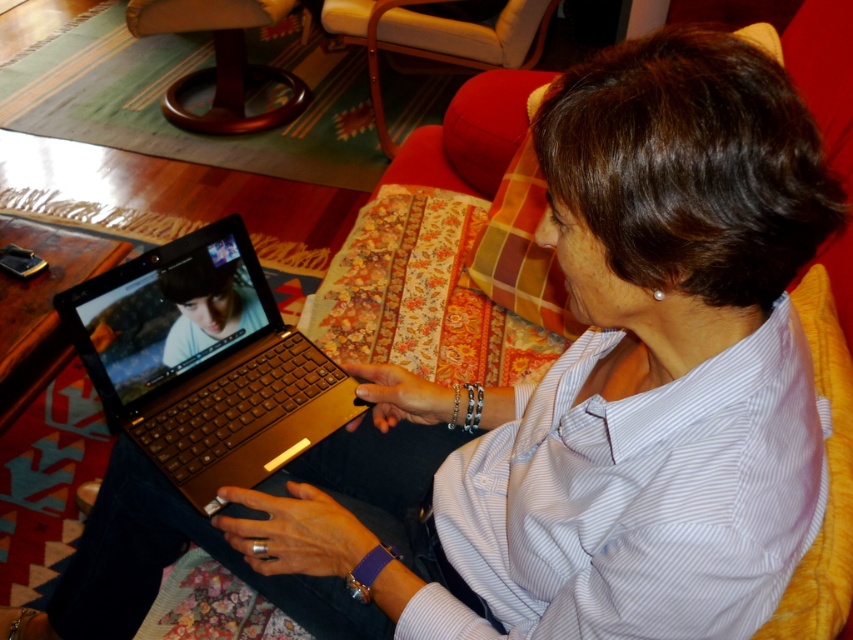
You are a delivery person who needs to place a small package on the gold metallic laptop at center. Can you safely place it there without obstructing the screen?

The gold metallic laptop at center is 92.41 centimeters away from the viewer, so yes, the delivery person can safely place the small package there without obstructing the screen.

You are a furniture designer evaluating seating options for a client who prefers taller chairs. Based on the scene, which chair would you recommend between the red leather armchair at upper center and the mahogany wood armchair at upper left?

The red leather armchair at upper center has a greater height compared to the mahogany wood armchair at upper left, so it would be the better recommendation for the client who prefers taller chairs.

You are standing in the room and want to place a small plant on the floor. The plant requires a spot that is exactly 3.54 feet away from you. Can you use the location marked by point (x=196, y=396) for this purpose?

Yes, the location marked by point (x=196, y=396) is exactly 3.54 feet away from you, so placing the plant there would meet the requirement.